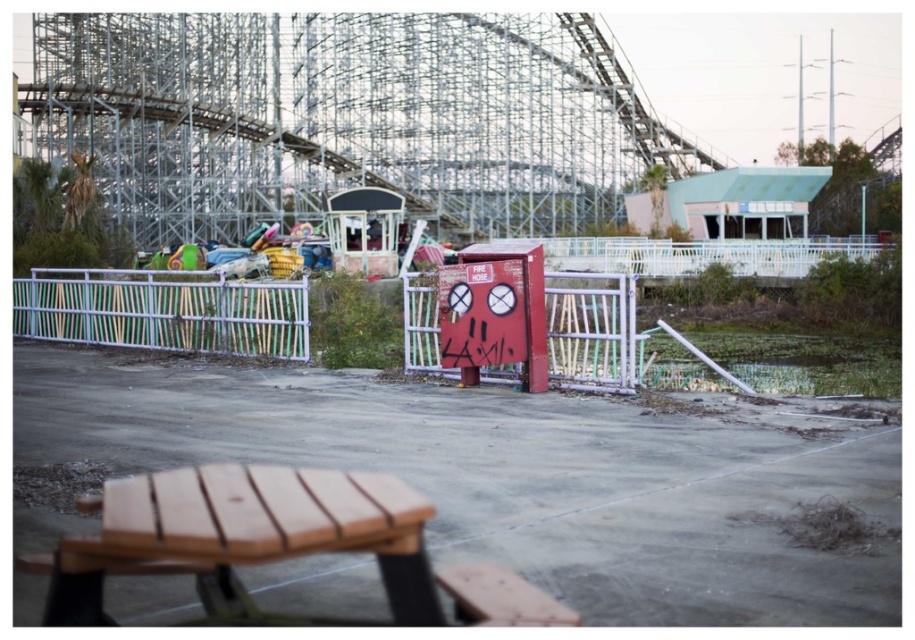
You are a maintenance worker needing to reach the red painted metal fire hose cabinet at center from the white painted wood fence at left. Given that your tool cart can only move 30 feet before needing a recharge, can you make it without recharging?

The distance between the red painted metal fire hose cabinet at center and the white painted wood fence at left is 32.74 feet, which exceeds the tool cart can travel 30 feet before needing a recharge. Therefore, you will need to recharge before reaching the red painted metal fire hose cabinet at center.

You are a maintenance worker tasked with assessing the height of objects in an abandoned amusement park. You see the red painted metal fire hose cabinet at center and the white painted wood fence at left. Which object is taller?

Result: The red painted metal fire hose cabinet at center is much taller than the white painted wood fence at left.